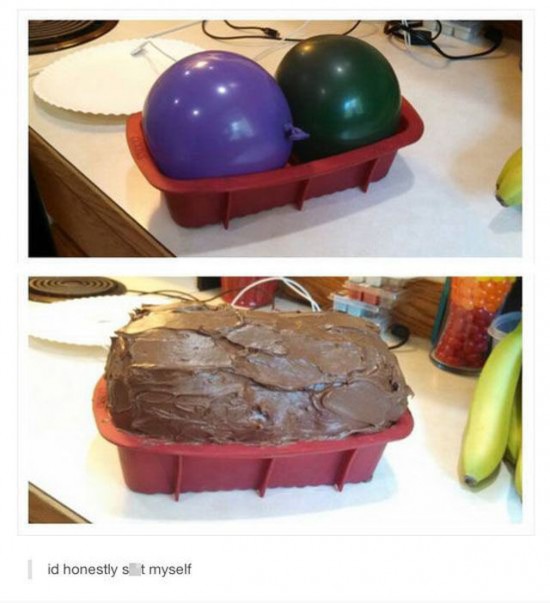
Locate an element on the screen. The width and height of the screenshot is (550, 603). burner is located at coordinates [82, 283], [82, 468].